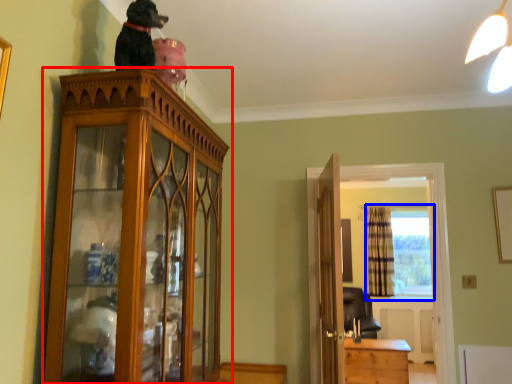
Question: Which object appears farthest to the camera in this image, cabinetry (highlighted by a red box) or window (highlighted by a blue box)?

Choices:
 (A) cabinetry
 (B) window

Answer: (B)